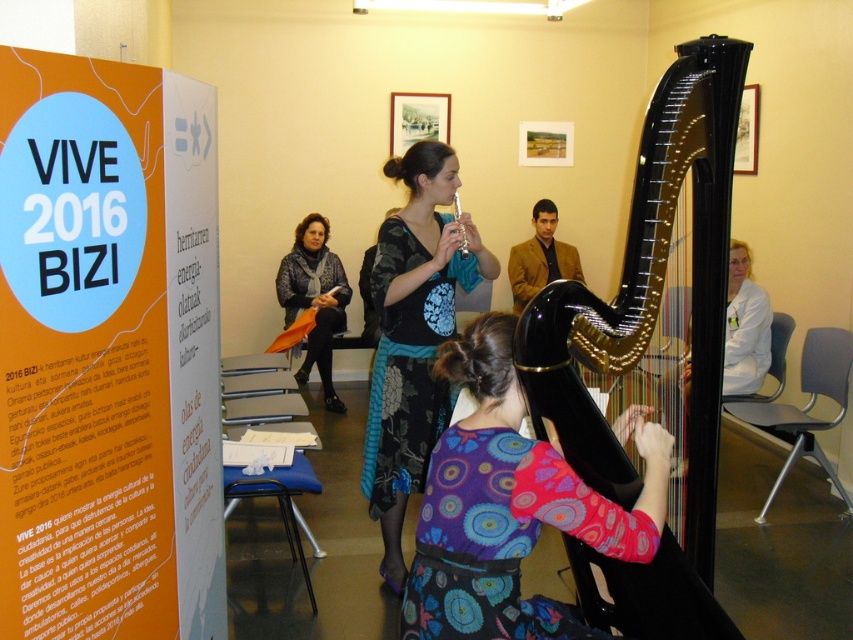
Question: Considering the relative positions of glossy black harp at center and floral dress at center in the image provided, where is glossy black harp at center located with respect to floral dress at center?

Choices:
 (A) above
 (B) below

Answer: (B)

Question: Where is knitted gray scarf at center located in relation to matte silver flute at center in the image?

Choices:
 (A) below
 (B) above

Answer: (A)

Question: Among these points, which one is farthest from the camera?

Choices:
 (A) (457, 205)
 (B) (331, 280)
 (C) (515, 298)
 (D) (42, 518)

Answer: (C)

Question: Observing the image, what is the correct spatial positioning of knitted gray scarf at center in reference to matte silver flute at center?

Choices:
 (A) above
 (B) below

Answer: (B)

Question: Which point appears farthest from the camera in this image?

Choices:
 (A) (389, 300)
 (B) (323, 368)
 (C) (453, 208)
 (D) (537, 227)

Answer: (C)

Question: Among these objects, which one is farthest from the camera?

Choices:
 (A) orange paper poster at upper left
 (B) glossy black harp at center
 (C) knitted gray scarf at center

Answer: (C)